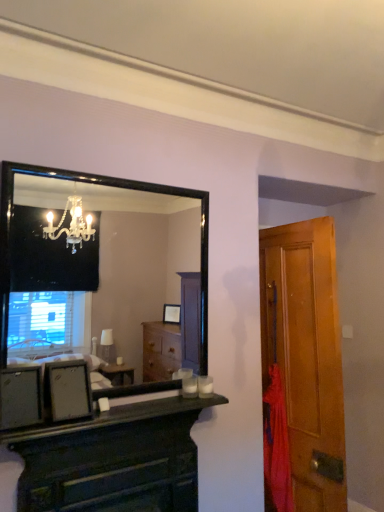
Describe the element at coordinates (113, 460) in the screenshot. I see `dark wood chest of drawers at center` at that location.

At what (x,y) coordinates should I click in order to perform the action: click on red fabric at right. Please return your answer as a coordinate pair (x, y). Looking at the image, I should click on (276, 444).

Is wooden door at right completely or partially outside of matte black picture frame at lower left?

That's correct, wooden door at right is outside of matte black picture frame at lower left.

Could you tell me if wooden door at right is turned towards matte black picture frame at lower left?

No, wooden door at right is not aimed at matte black picture frame at lower left.

From the image's perspective, between wooden door at right and matte black picture frame at lower left, which one is located above?

matte black picture frame at lower left, from the image's perspective.

Which is more to the right, wooden door at right or black glossy mirror at upper left?

Positioned to the right is wooden door at right.

Measure the distance between wooden door at right and black glossy mirror at upper left.

A distance of 7.73 feet exists between wooden door at right and black glossy mirror at upper left.

Does point (320, 509) appear closer or farther from the camera than point (34, 207)?

Point (320, 509).

Are wooden door at right and black glossy mirror at upper left far apart?

wooden door at right is far away from black glossy mirror at upper left.

Would you say matte black picture frame at lower left is a long distance from dark wood chest of drawers at center?

No.

Find the location of `chest of drawers located on the right of matte black picture frame at lower left`. chest of drawers located on the right of matte black picture frame at lower left is located at coordinates (113, 460).

In terms of height, does matte black picture frame at lower left look taller or shorter compared to dark wood chest of drawers at center?

matte black picture frame at lower left is shorter than dark wood chest of drawers at center.

Between red fabric at right and black glossy mirror at upper left, which one appears on the left side from the viewer's perspective?

black glossy mirror at upper left is more to the left.

Is point (287, 480) closer or farther from the camera than point (73, 326)?

Point (287, 480) appears to be closer to the viewer than point (73, 326).

Would you consider red fabric at right to be distant from black glossy mirror at upper left?

Yes, red fabric at right is far from black glossy mirror at upper left.

Which of these two, red fabric at right or black glossy mirror at upper left, stands shorter?

black glossy mirror at upper left is shorter.

Where is `the chest of drawers that appears below the red fabric at right (from the image's perspective)`? the chest of drawers that appears below the red fabric at right (from the image's perspective) is located at coordinates (113, 460).

Is the position of red fabric at right less distant than that of dark wood chest of drawers at center?

No, it is behind dark wood chest of drawers at center.

From a real-world perspective, is red fabric at right below dark wood chest of drawers at center?

No.

What are the coordinates of `the chest of drawers located in front of the wooden door at right` in the screenshot? It's located at (113, 460).

In the image, is dark wood chest of drawers at center positioned in front of or behind wooden door at right?

dark wood chest of drawers at center is positioned closer to the viewer than wooden door at right.

In the scene shown: Which object is thinner, dark wood chest of drawers at center or wooden door at right?

dark wood chest of drawers at center.

From the image's perspective, which one is positioned lower, dark wood chest of drawers at center or wooden door at right?

dark wood chest of drawers at center, from the image's perspective.

Are dark wood chest of drawers at center and matte black picture frame at lower left far apart?

No.

Find the location of `chest of drawers located on the right of matte black picture frame at lower left`. chest of drawers located on the right of matte black picture frame at lower left is located at coordinates (113, 460).

Based on the photo, considering the relative sizes of dark wood chest of drawers at center and matte black picture frame at lower left in the image provided, is dark wood chest of drawers at center taller than matte black picture frame at lower left?

Correct, dark wood chest of drawers at center is much taller as matte black picture frame at lower left.

In the scene shown: Could you measure the distance between dark wood chest of drawers at center and matte black picture frame at lower left?

dark wood chest of drawers at center is 11.68 inches away from matte black picture frame at lower left.

Image resolution: width=384 pixels, height=512 pixels. In the image, there is a matte black picture frame at lower left. Find the location of `door below it (from a real-world perspective)`. door below it (from a real-world perspective) is located at coordinates (302, 369).

In the image, there is a wooden door at right. At what (x,y) coordinates should I click in order to perform the action: click on mirror above it (from the image's perspective). Please return your answer as a coordinate pair (x, y). This screenshot has width=384, height=512. Looking at the image, I should click on (99, 267).

From the image, which object appears to be farther from black glossy mirror at upper left, wooden door at right or dark wood chest of drawers at center?

The object further to black glossy mirror at upper left is dark wood chest of drawers at center.

From the image, which object appears to be farther from red fabric at right, black glossy mirror at upper left or matte black picture frame at lower left?

black glossy mirror at upper left is positioned further to the anchor red fabric at right.

Which object lies nearer to the anchor point wooden door at right, red fabric at right or matte black picture frame at lower left?

red fabric at right lies closer to wooden door at right than the other object.

When comparing their distances from black glossy mirror at upper left, does dark wood chest of drawers at center or wooden door at right seem closer?

wooden door at right.

Estimate the real-world distances between objects in this image. Which object is closer to wooden door at right, matte black picture frame at lower left or dark wood chest of drawers at center?

dark wood chest of drawers at center lies closer to wooden door at right than the other object.

Based on their spatial positions, is red fabric at right or black glossy mirror at upper left closer to wooden door at right?

Based on the image, red fabric at right appears to be nearer to wooden door at right.

Based on their spatial positions, is dark wood chest of drawers at center or red fabric at right closer to wooden door at right?

red fabric at right.

Consider the image. Which object lies further to the anchor point red fabric at right, dark wood chest of drawers at center or matte black picture frame at lower left?

The object further to red fabric at right is matte black picture frame at lower left.

The height and width of the screenshot is (512, 384). I want to click on chest of drawers between black glossy mirror at upper left and wooden door at right, so click(x=113, y=460).

What are the coordinates of `chest of drawers between matte black picture frame at lower left and wooden door at right in the horizontal direction` in the screenshot? It's located at (113, 460).

This screenshot has height=512, width=384. Identify the location of mirror situated between matte black picture frame at lower left and red fabric at right from left to right. (99, 267).

Find the location of `mirror situated between matte black picture frame at lower left and wooden door at right from left to right`. mirror situated between matte black picture frame at lower left and wooden door at right from left to right is located at coordinates (99, 267).